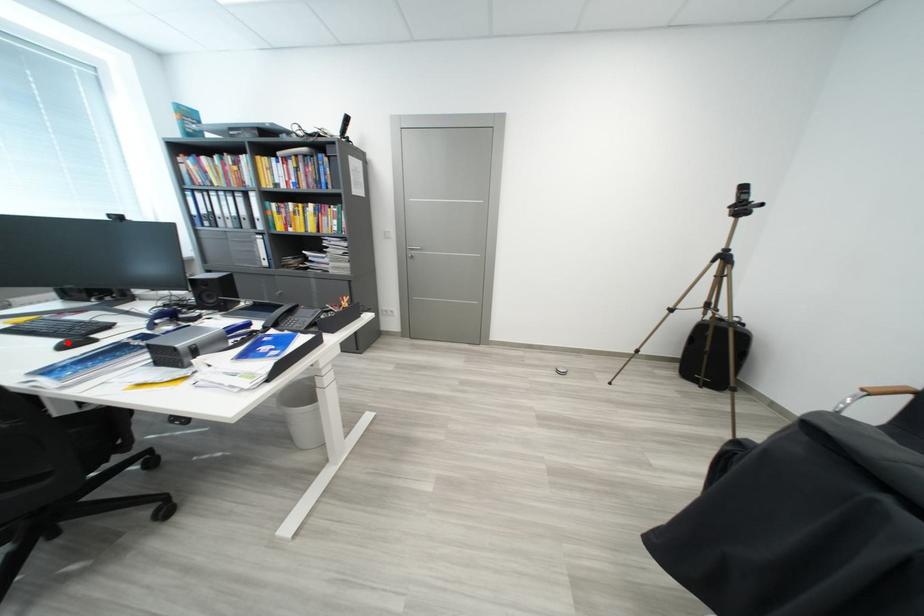
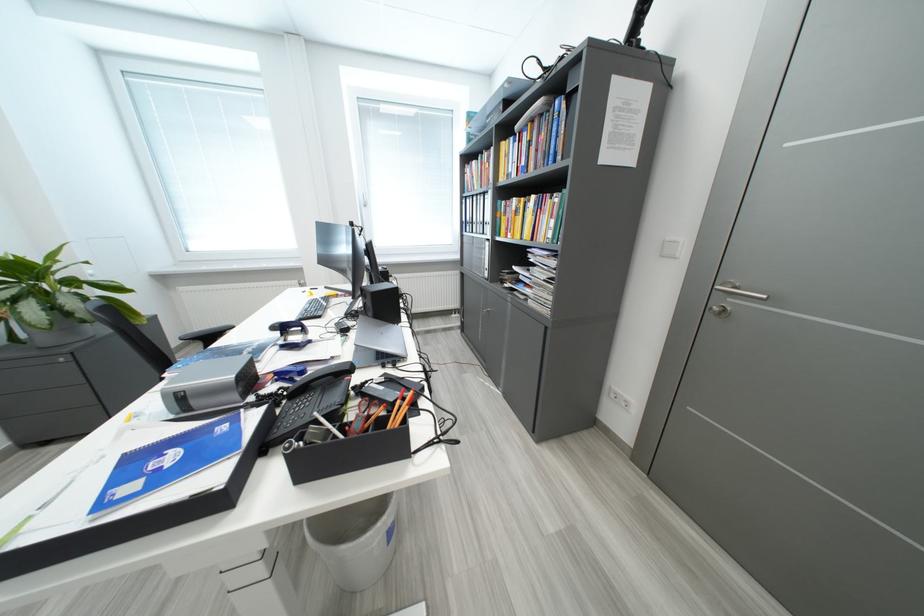
Question: I am providing you with two images of the same scene from different viewpoints. A red point is shown in image1. For the corresponding object point in image2, is it positioned nearer or farther from the camera?

Choices:
 (A) Nearer
 (B) Farther

Answer: (A)